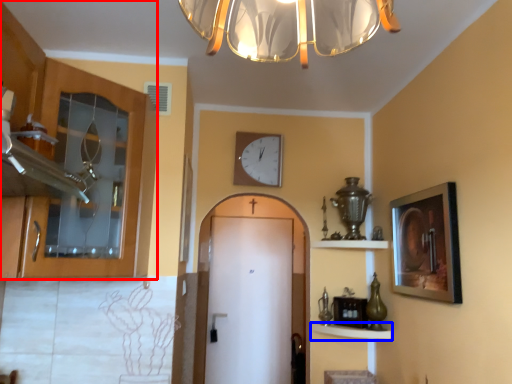
Question: Among these objects, which one is farthest to the camera, cabinetry (highlighted by a red box) or shelf (highlighted by a blue box)?

Choices:
 (A) cabinetry
 (B) shelf

Answer: (B)